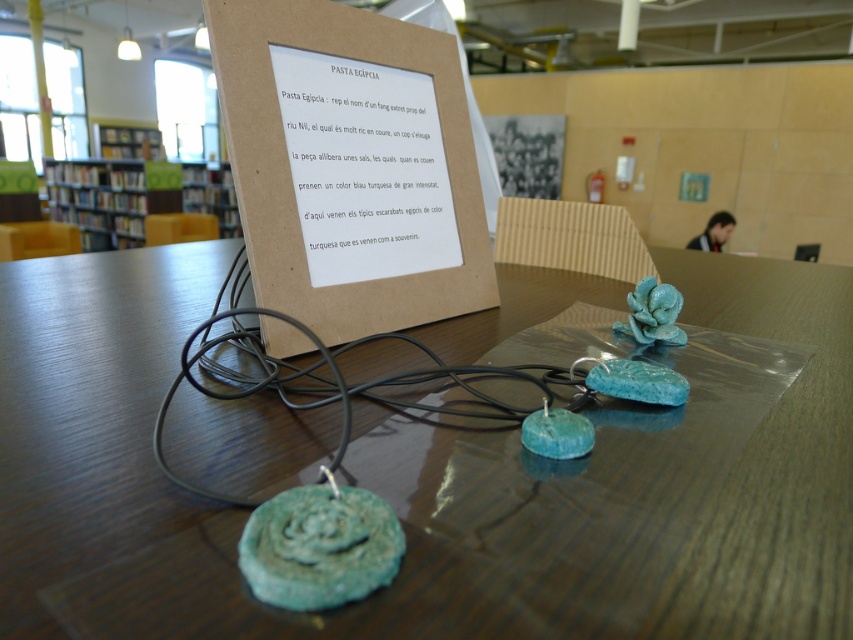
You are a technician trying to reach the black wire at center from the shiny brown table at center. Can you reach it without moving the table?

The distance between the shiny brown table at center and the black wire at center is 10.47 centimeters. Since the technician can likely stretch their arm to cover that distance, they can reach the black wire at center without moving the shiny brown table at center.